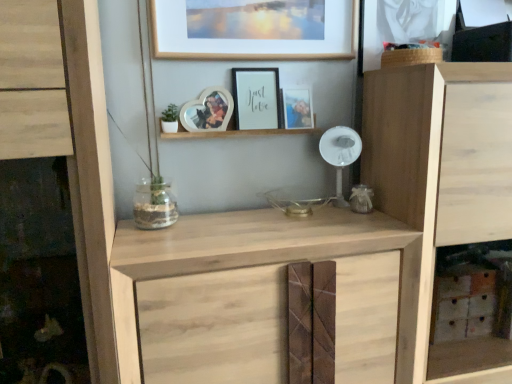
Where is `vacant region in front of white plastic fan at center`? Image resolution: width=512 pixels, height=384 pixels. vacant region in front of white plastic fan at center is located at coordinates (346, 216).